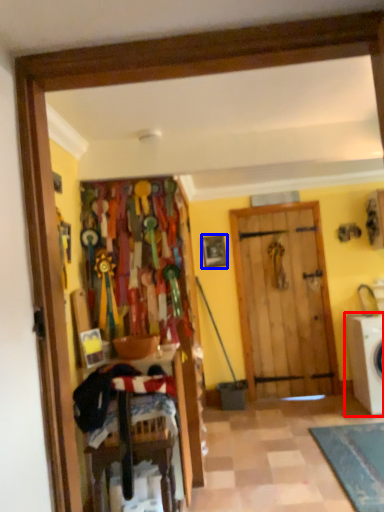
Question: Which point is closer to the camera, washing machine (highlighted by a red box) or picture frame (highlighted by a blue box)?

Choices:
 (A) washing machine
 (B) picture frame

Answer: (A)